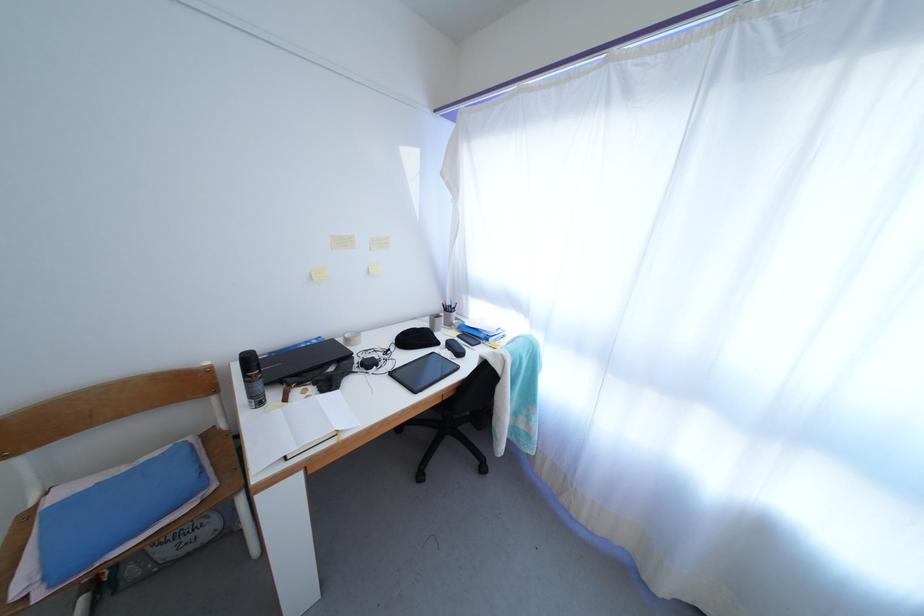
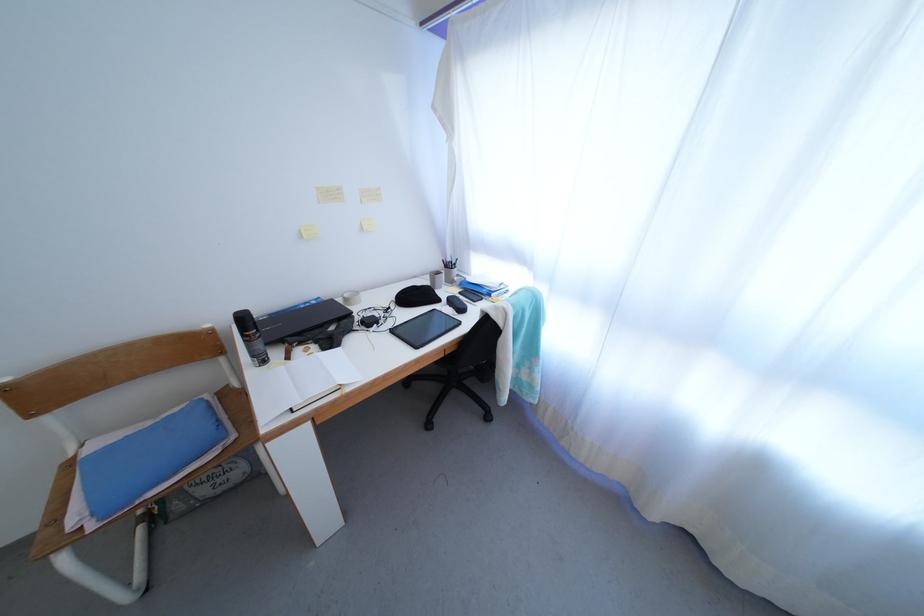
Which direction would the cameraman need to move to produce the second image?

The cameraman moved toward right, forward.